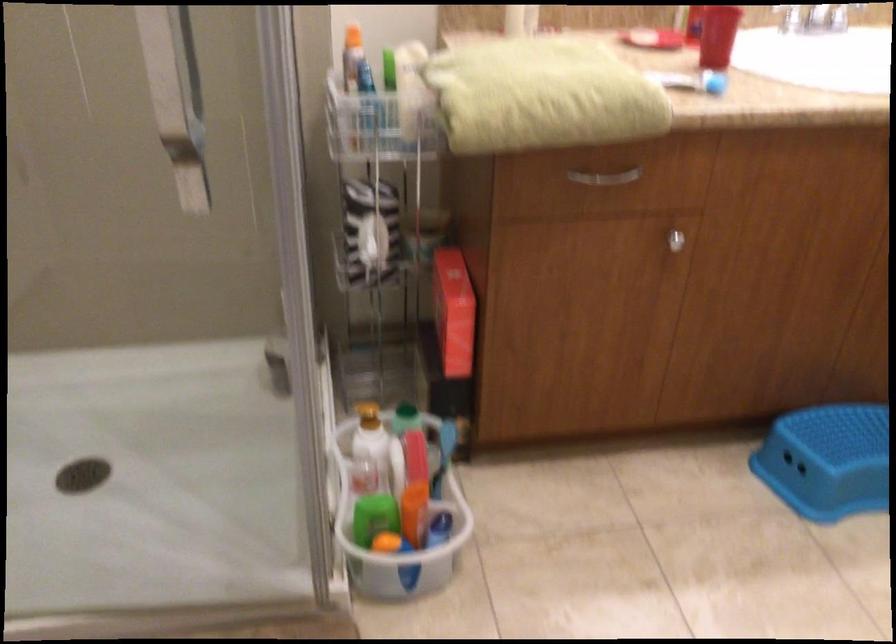
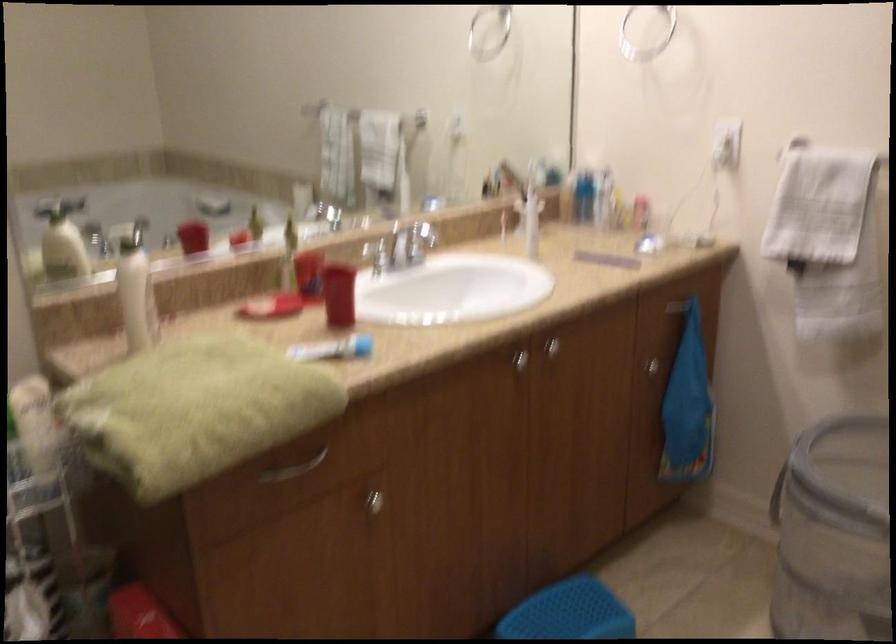
The point at [607,176] is marked in the first image. Where is the corresponding point in the second image?

(294, 468)